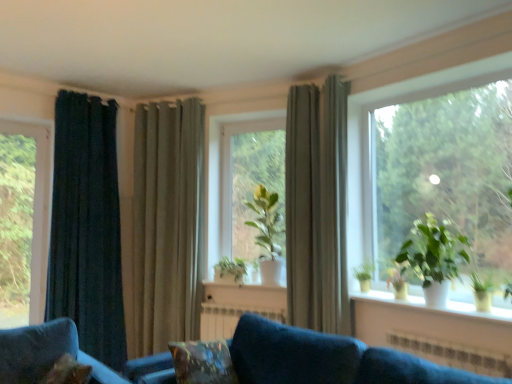
Measure the distance between point (268, 316) and camera.

Point (268, 316) and camera are 3.84 meters apart from each other.

What is the approximate height of green matte plant at center, which appears as the second houseplant when viewed from the front?

38.05 inches.

What do you see at coordinates (317, 207) in the screenshot? This screenshot has width=512, height=384. I see `satin beige curtain at center, positioned as the first curtain in right-to-left order` at bounding box center [317, 207].

Measure the distance between green matte plant at center, marked as the first houseplant in a left-to-right arrangement, and camera.

The distance of green matte plant at center, marked as the first houseplant in a left-to-right arrangement, from camera is 4.03 meters.

You are a GUI agent. You are given a task and a screenshot of the screen. Output one action in this format:
    pyautogui.click(x=<x>, y=<y>)
    Task: Click on the white metallic radiator at center
    
    Given the screenshot: What is the action you would take?
    pyautogui.click(x=230, y=318)

Does green matte plant at center have a lesser height compared to satin beige curtain at center, positioned as the first curtain in right-to-left order?

Yes.

Is green matte plant at center turned away from satin beige curtain at center, positioned as the first curtain in right-to-left order?

That's not correct — green matte plant at center is not looking away from satin beige curtain at center, positioned as the first curtain in right-to-left order.

Considering the positions of point (252, 127) and point (324, 96), is point (252, 127) closer or farther from the camera than point (324, 96)?

Clearly, point (252, 127) is more distant from the camera than point (324, 96).

From a real-world perspective, who is located higher, green matte plant at center, which appears as the 3th houseplant when viewed from the front, or velvet blue couch at lower center?

green matte plant at center, which appears as the 3th houseplant when viewed from the front.

Can you tell me how much green matte plant at center, marked as the first houseplant in a left-to-right arrangement, and velvet blue couch at lower center differ in facing direction?

green matte plant at center, marked as the first houseplant in a left-to-right arrangement, and velvet blue couch at lower center are facing 27.8 degrees away from each other.

From the image's perspective, is green matte plant at center, marked as the first houseplant in a left-to-right arrangement, located above or below velvet blue couch at lower center?

Clearly, from the image's perspective, green matte plant at center, marked as the first houseplant in a left-to-right arrangement, is above velvet blue couch at lower center.

From the picture: Is green matte plant at center, marked as the first houseplant in a left-to-right arrangement, outside of velvet blue couch at lower center?

That's correct, green matte plant at center, marked as the first houseplant in a left-to-right arrangement, is outside of velvet blue couch at lower center.

Can you tell me how much satin beige curtain at center, positioned as the first curtain in right-to-left order, and white metallic radiator at center differ in facing direction?

30.6 degrees separate the facing orientations of satin beige curtain at center, positioned as the first curtain in right-to-left order, and white metallic radiator at center.

Is satin beige curtain at center, which is counted as the third curtain, starting from the left, positioned beyond the bounds of white metallic radiator at center?

satin beige curtain at center, which is counted as the third curtain, starting from the left, is positioned outside white metallic radiator at center.

Is satin beige curtain at center, positioned as the first curtain in right-to-left order, wider than white metallic radiator at center?

Yes.

Are satin beige curtain at center, positioned as the first curtain in right-to-left order, and white metallic radiator at center located far from each other?

Actually, satin beige curtain at center, positioned as the first curtain in right-to-left order, and white metallic radiator at center are a little close together.

Is white metallic radiator at center directly adjacent to satin beige curtain at center, which is counted as the third curtain, starting from the left?

white metallic radiator at center and satin beige curtain at center, which is counted as the third curtain, starting from the left, are not in contact.

Is white metallic radiator at center oriented away from satin beige curtain at center, which is counted as the third curtain, starting from the left?

No.

The height and width of the screenshot is (384, 512). I want to click on the 2nd curtain in front of the white metallic radiator at center, starting your count from the anchor, so click(317, 207).

What's the angular difference between white metallic radiator at center and satin beige curtain at center, which is counted as the third curtain, starting from the left,'s facing directions?

30.6 degrees.

Is velvety brown pillow at lower center inside or outside of white metallic radiator at center?

velvety brown pillow at lower center cannot be found inside white metallic radiator at center.

Who is smaller, velvety brown pillow at lower center or white metallic radiator at center?

Smaller between the two is white metallic radiator at center.

Which point is more distant from viewer, (209, 351) or (203, 315)?

The point (203, 315) is farther.

From the image's perspective, is green matte plant at center under green matte plant at center, positioned as the third houseplant in right-to-left order?

No.

Does point (228, 137) lie in front of point (244, 271)?

No.

Can we say green matte plant at center lies outside green matte plant at center, positioned as the third houseplant in right-to-left order?

Yes, green matte plant at center is located beyond the bounds of green matte plant at center, positioned as the third houseplant in right-to-left order.

Is transparent glass window at left, the 2th window viewed from the front, positioned beyond the bounds of transparent glass window at upper right, arranged as the first window when viewed from the right?

transparent glass window at left, the 2th window viewed from the front, is positioned outside transparent glass window at upper right, arranged as the first window when viewed from the right.

Consider the image. Visually, is transparent glass window at left, which ranks as the 1th window in back-to-front order, positioned to the left or to the right of transparent glass window at upper right, placed as the first window when sorted from front to back?

A: Based on their positions, transparent glass window at left, which ranks as the 1th window in back-to-front order, is located to the left of transparent glass window at upper right, placed as the first window when sorted from front to back.

Identify the location of window to the left of transparent glass window at upper right, placed as the first window when sorted from front to back. (24, 220).

Can you confirm if transparent glass window at left, which ranks as the 1th window in back-to-front order, is thinner than transparent glass window at upper right, placed as the first window when sorted from front to back?

Yes, transparent glass window at left, which ranks as the 1th window in back-to-front order, is thinner than transparent glass window at upper right, placed as the first window when sorted from front to back.

This screenshot has height=384, width=512. I want to click on curtain on the right side of green matte plant at center, so click(x=317, y=207).

The height and width of the screenshot is (384, 512). There is a velvet blue couch at lower center. What are the coordinates of `the 1st houseplant above it (from a real-world perspective)` in the screenshot? It's located at (231, 271).

From the picture: Looking at the image, which one is located closer to satin beige curtain at center, positioned as the first curtain in right-to-left order, transparent glass window at left, the 2th window viewed from the front, or green matte plant at center, acting as the 1th houseplant starting from the back?

green matte plant at center, acting as the 1th houseplant starting from the back, is closer to satin beige curtain at center, positioned as the first curtain in right-to-left order.

Looking at this image, considering their positions, is dark green velvet curtain at left, acting as the 1th curtain starting from the left, positioned closer to velvet blue couch at lower center than white metallic radiator at center?

Answer: white metallic radiator at center lies closer to velvet blue couch at lower center than the other object.

From the image, which object appears to be nearer to green matte plant at right, which is counted as the 3th houseplant, starting from the left, white ceramic plant pots at lower right or satin beige curtain at center, which is counted as the third curtain, starting from the left?

white ceramic plant pots at lower right lies closer to green matte plant at right, which is counted as the 3th houseplant, starting from the left, than the other object.

When comparing their distances from transparent glass window at left, which ranks as the 1th window in back-to-front order, does transparent glass window at upper right, arranged as the first window when viewed from the right, or green matte plant at center seem closer?

green matte plant at center is closer to transparent glass window at left, which ranks as the 1th window in back-to-front order.

Considering their positions, is green matte plant at center positioned further to green matte plant at center, which appears as the 3th houseplant when viewed from the front, than green matte plant at center, which appears as the 2th houseplant when viewed from the left?

Among the two, green matte plant at center is located further to green matte plant at center, which appears as the 3th houseplant when viewed from the front.

From the image, which object appears to be farther from white ceramic plant pots at lower right, transparent glass window at upper right, arranged as the first window when viewed from the right, or velvet blue couch at lower center?

transparent glass window at upper right, arranged as the first window when viewed from the right.

Estimate the real-world distances between objects in this image. Which object is closer to green matte plant at center, positioned as the third houseplant in right-to-left order, green matte plant at right, which is counted as the 3th houseplant, starting from the left, or velvet blue couch at lower center?

velvet blue couch at lower center lies closer to green matte plant at center, positioned as the third houseplant in right-to-left order, than the other object.

From the image, which object appears to be nearer to satin beige curtain at center, positioned as the first curtain in right-to-left order, velvety brown pillow at lower center or white metallic radiator at center?

white metallic radiator at center is positioned closer to the anchor satin beige curtain at center, positioned as the first curtain in right-to-left order.

At what (x,y) coordinates should I click in order to perform the action: click on window sill between velvet blue couch at lower center and satin beige curtain at center, which is counted as the third curtain, starting from the left, along the z-axis. Please return your answer as a coordinate pair (x, y). Looking at the image, I should click on (435, 307).

I want to click on pillow between velvet blue couch at lower center and dark green velvet curtain at left, acting as the 1th curtain starting from the left, along the z-axis, so click(202, 362).

The height and width of the screenshot is (384, 512). I want to click on pillow between transparent glass window at left, which ranks as the 1th window in back-to-front order, and white metallic radiator at center from left to right, so click(x=202, y=362).

Locate an element on the screen. This screenshot has width=512, height=384. houseplant between velvet blue couch at lower center and satin beige curtain at center, positioned as the first curtain in right-to-left order, in the front-back direction is located at coordinates (434, 257).